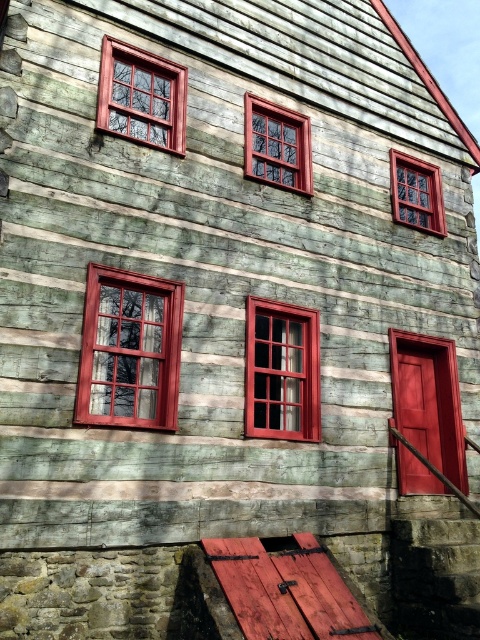
Which is more to the right, matte wood window at upper left or wooden window at center?

wooden window at center

Who is more forward, (111, 80) or (402, 164)?

Point (111, 80) is more forward.

Where is `matte wood window at upper left`? This screenshot has width=480, height=640. matte wood window at upper left is located at coordinates (142, 97).

Is matte wood window at center bigger than wooden window at center?

Indeed, matte wood window at center has a larger size compared to wooden window at center.

Is point (288, 404) positioned before point (405, 212)?

That is True.

Where is `matte wood window at center`? The width and height of the screenshot is (480, 640). matte wood window at center is located at coordinates (282, 371).

Does matte wood window at center appear over matte wood window at upper center?

Actually, matte wood window at center is below matte wood window at upper center.

Is matte wood window at center to the right of matte wood window at upper center from the viewer's perspective?

Correct, you'll find matte wood window at center to the right of matte wood window at upper center.

Image resolution: width=480 pixels, height=640 pixels. What do you see at coordinates (282, 371) in the screenshot? I see `matte wood window at center` at bounding box center [282, 371].

Locate an element on the screen. matte wood window at center is located at coordinates (282, 371).